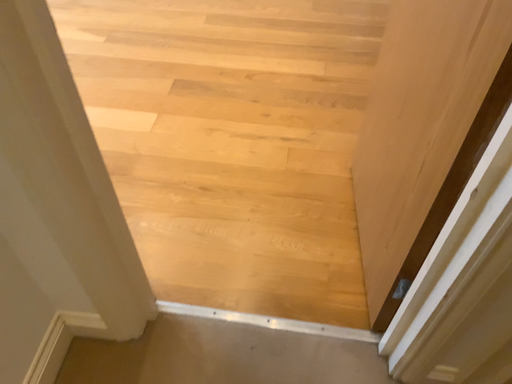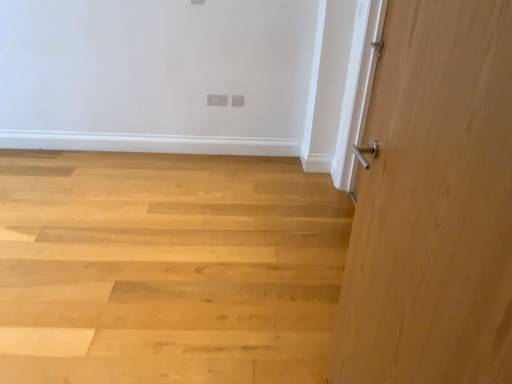
Question: Which way did the camera rotate in the video?

Choices:
 (A) rotated downward
 (B) rotated upward

Answer: (B)